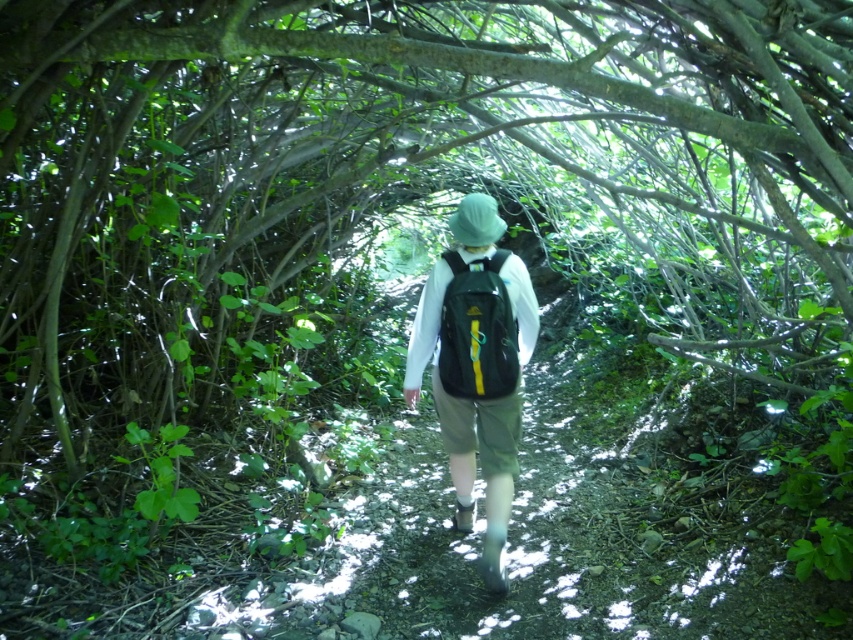
Who is more forward, [509,355] or [447,337]?

Point [509,355] is in front.

Does matte black backpack at center appear on the left side of matte green backpack at center?

In fact, matte black backpack at center is to the right of matte green backpack at center.

Is point (410, 352) closer to viewer compared to point (456, 269)?

No, it is not.

Locate an element on the screen. The width and height of the screenshot is (853, 640). matte black backpack at center is located at coordinates (476, 365).